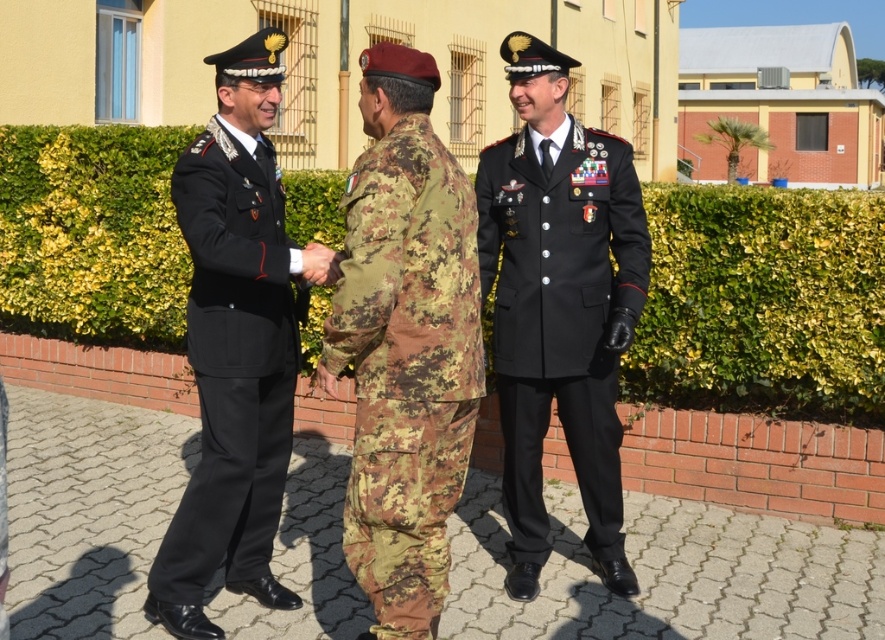
Looking at this image, you are a photographer trying to capture a closeup of the black woolen coat at center and the black woolen uniform at left. Since you want to focus on the details of both, which one should you zoom in on first to ensure the larger one is in frame?

The black woolen coat at center is larger in size than the black woolen uniform at left. Therefore, you should first zoom in on the black woolen coat at center to ensure it fits in the frame before adjusting for the smaller one.